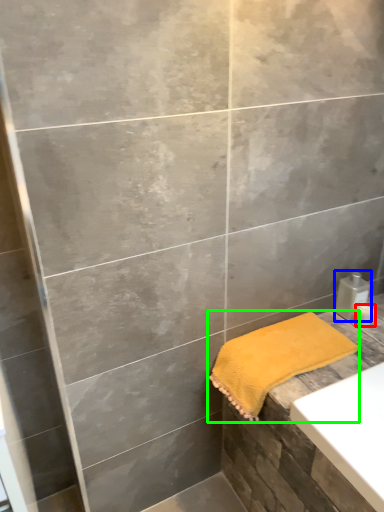
Question: Based on their relative distances, which object is nearer to toiletry (highlighted by a red box)? Choose from soap dispenser (highlighted by a blue box) and towel (highlighted by a green box).

Choices:
 (A) soap dispenser
 (B) towel

Answer: (A)